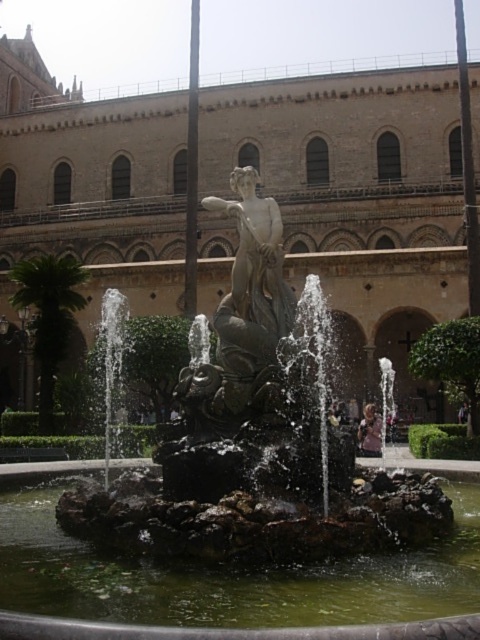
You are standing in the courtyard and want to pour water from the green stone water at center onto the matte bronze statue at center. Can you do this directly without moving either object?

The green stone water at center is to the right of the matte bronze statue at center, so you can pour water directly from the green stone water at center onto the matte bronze statue at center since they are adjacent.

You are standing in the courtyard and want to take a photo of the brick stone palace at center and the bronze statue at center. Since you can only focus on one object at a time, which one should you position closer to the camera to ensure it is in focus while the other remains blurred?

You should position the bronze statue at center closer to the camera because the brick stone palace at center is to the right of bronze statue at center, so adjusting the focus on the closer object will blur the background.